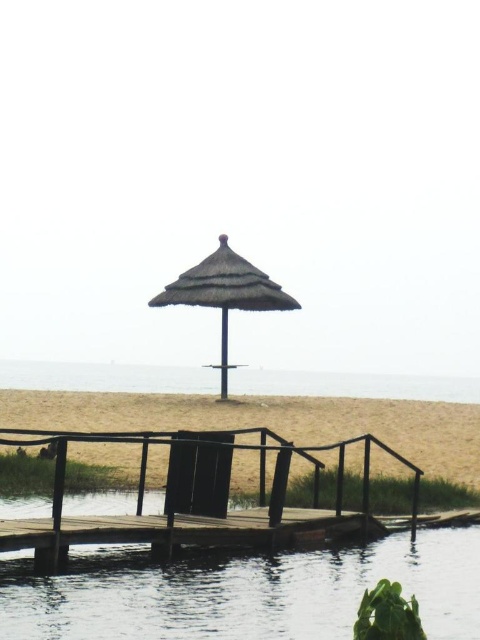
Can you confirm if black woven beach chair at center is bigger than brown woven pole at center?

Yes, black woven beach chair at center is bigger than brown woven pole at center.

Who is more distant from viewer, [205,468] or [225,374]?

The point [225,374] is behind.

Where is `black woven beach chair at center`? black woven beach chair at center is located at coordinates (197, 477).

Does transparent water at dock center have a greater height compared to brown woven pole at center?

Incorrect, transparent water at dock center's height is not larger of brown woven pole at center's.

Which is in front, point (50, 624) or point (226, 317)?

Positioned in front is point (50, 624).

Where is `transparent water at dock center`? The image size is (480, 640). transparent water at dock center is located at coordinates (240, 592).

Is point (374, 403) less distant than point (183, 468)?

No, it is behind (183, 468).

Who is positioned more to the right, beige sand beach at lower center or black woven beach chair at center?

Positioned to the right is beige sand beach at lower center.

This screenshot has width=480, height=640. Identify the location of beige sand beach at lower center. (268, 420).